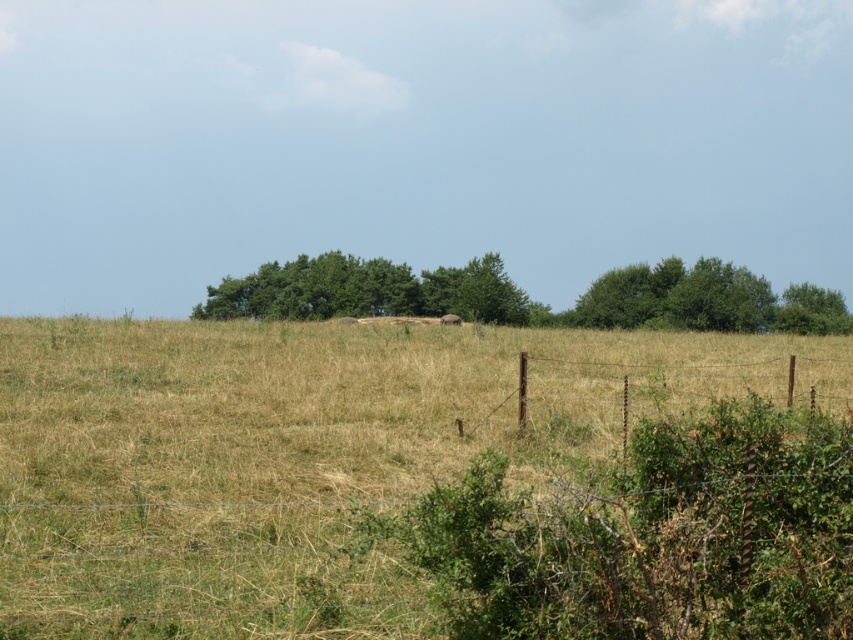
You are standing in front of the barbed wire fence in the rural landscape. You notice two green leafy trees in the background. Which tree, the green leafy tree at center or the green leafy tree at upper right, is located more to the right side of the image?

The green leafy tree at upper right is more to the right side of the image because the green leafy tree at center is positioned on the left side of it.